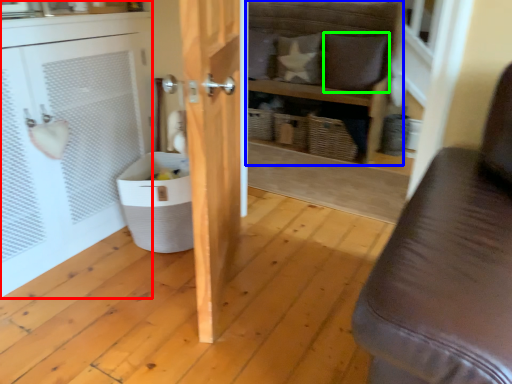
Question: Which object is the closest to the cabinetry (highlighted by a red box)? Choose among these: shelf (highlighted by a blue box) or pillow (highlighted by a green box).

Choices:
 (A) shelf
 (B) pillow

Answer: (A)